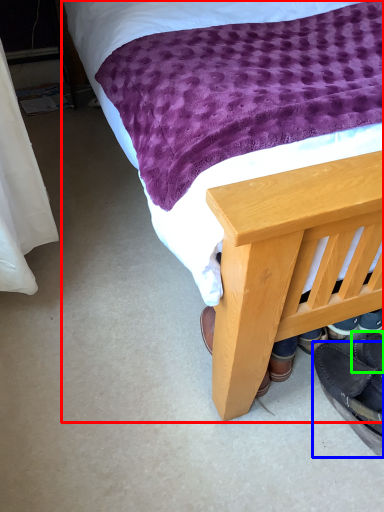
Question: Estimate the real-world distances between objects in this image. Which object is closer to bed (highlighted by a red box), footwear (highlighted by a blue box) or footwear (highlighted by a green box)?

Choices:
 (A) footwear
 (B) footwear

Answer: (A)